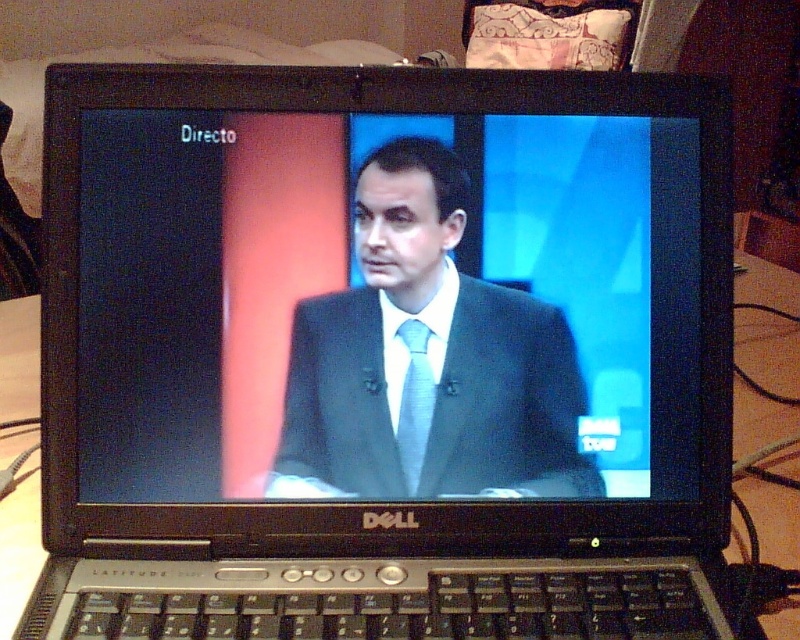
You are a fashion designer analyzing the live broadcast on the Dell Latitude laptop. You notice the presenter wearing a matte black suit at center and a light blue silk tie at center. Which clothing item is positioned to the right side of the other?

The matte black suit at center is to the right of the light blue silk tie at center, so the matte black suit at center is positioned to the right of the light blue silk tie at center.

You are a fashion designer analyzing the live broadcast on the Dell Latitude laptop. You need to determine which item is taller between the matte black suit at center and the light blue silk tie at center. Based on the image, which one is taller?

The matte black suit at center is taller than the light blue silk tie at center according to the image details.

You are a fashion designer observing a live broadcast on a Dell Latitude laptop. You notice the matte black suit at center and the light blue silk tie at center. Which clothing item appears closer to the camera in the broadcast?

The matte black suit at center appears closer to the camera because the light blue silk tie at center is behind it.